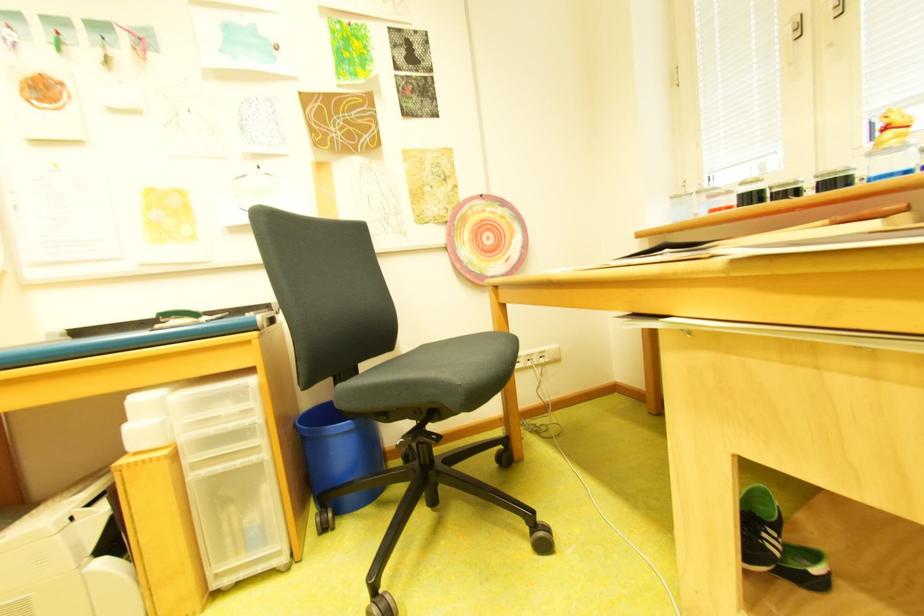
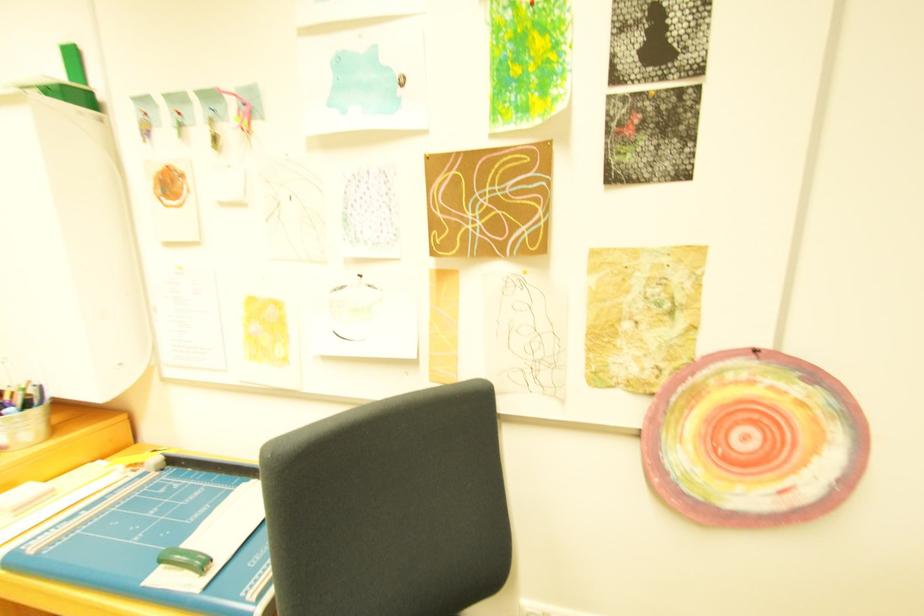
Question: The first image is from the beginning of the video and the second image is from the end. How did the camera likely rotate when shooting the video?

Choices:
 (A) Left
 (B) Right
 (C) Up
 (D) Down

Answer: (A)